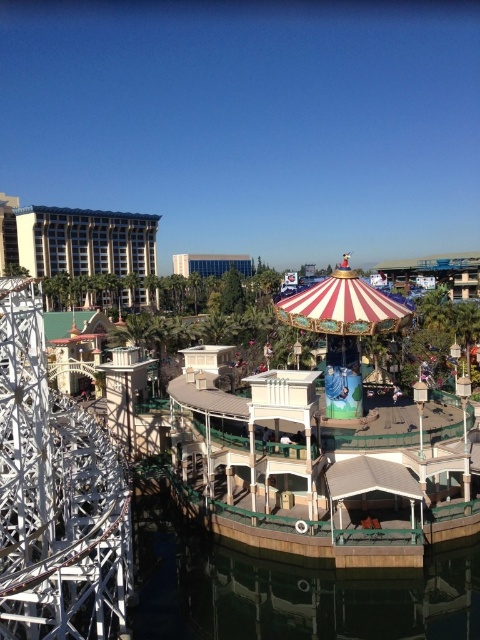
Question: Does brown wood water at lower center lie behind striped fabric carousel at center?

Choices:
 (A) yes
 (B) no

Answer: (B)

Question: Is brown wood water at lower center positioned before striped fabric carousel at center?

Choices:
 (A) no
 (B) yes

Answer: (B)

Question: Which point appears closest to the camera in this image?

Choices:
 (A) (372, 605)
 (B) (298, 324)

Answer: (A)

Question: Is brown wood water at lower center closer to camera compared to striped fabric carousel at center?

Choices:
 (A) no
 (B) yes

Answer: (B)